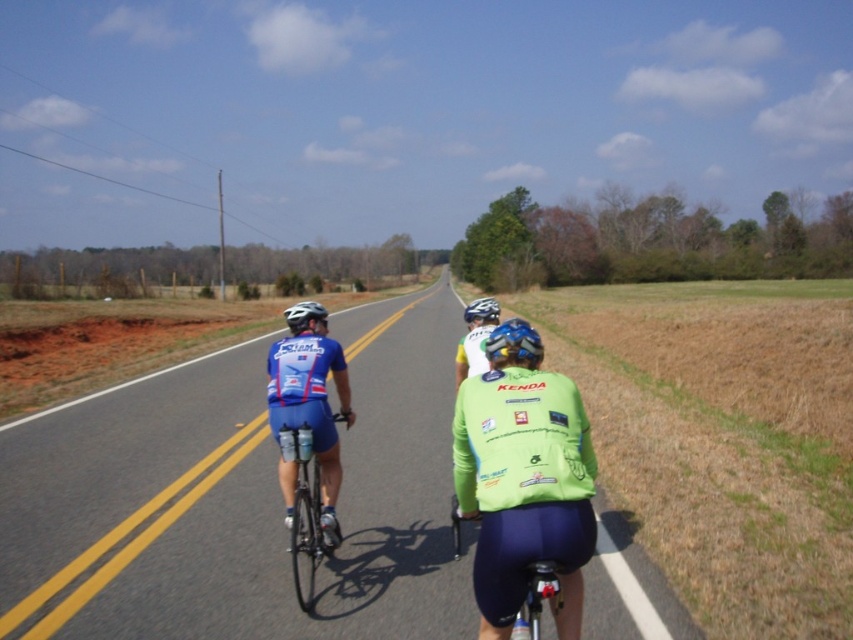
Question: Which object appears closest to the camera in this image?

Choices:
 (A) blue matte helmet at center
 (B) light green jersey at center
 (C) green jersey at center
 (D) white matte bicycle helmet at upper center

Answer: (C)

Question: Does green jersey at center have a larger size compared to blue matte helmet at center?

Choices:
 (A) no
 (B) yes

Answer: (A)

Question: Which point is closer to the camera taking this photo?

Choices:
 (A) (323, 307)
 (B) (469, 310)
 (C) (329, 548)
 (D) (489, 333)

Answer: (C)

Question: Is the position of matte blue cycling jersey at center more distant than that of white matte bicycle helmet at upper center?

Choices:
 (A) yes
 (B) no

Answer: (B)

Question: Can you confirm if green matte jersey at center is thinner than matte blue cycling jersey at center?

Choices:
 (A) yes
 (B) no

Answer: (B)

Question: Which object is positioned farthest from the matte blue cycling jersey at center?

Choices:
 (A) shiny black frame at center
 (B) green jersey at center

Answer: (A)